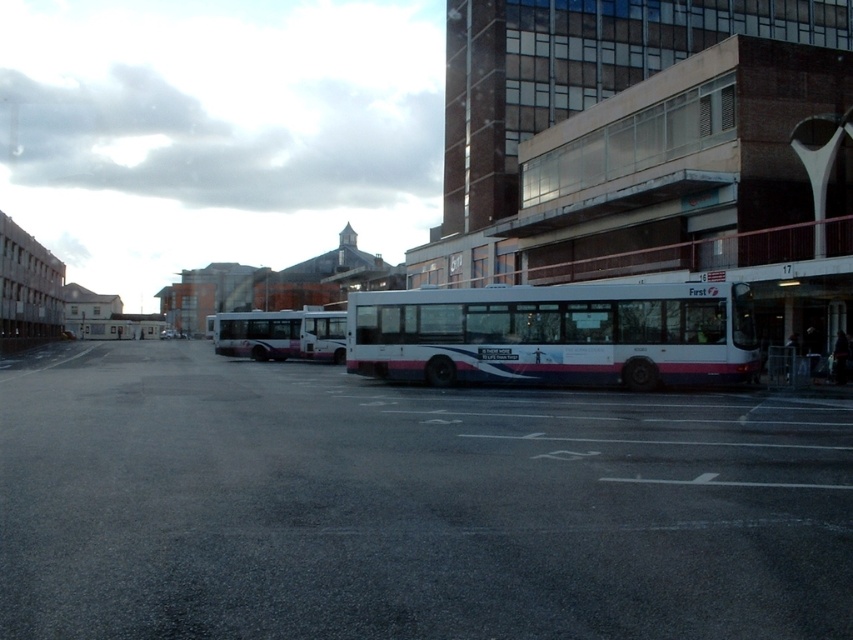
You are standing in the parking lot and want to reach a specific point marked at coordinates point (654, 563). If you can walk 3 meters per minute, how long will it take you to reach that point?

The distance of point (654, 563) from viewer is 6.22 meters. At a walking speed of 3 meters per minute, it would take approximately 2.07 minutes to reach the point.

You are a pedestrian standing at the edge of the parking lot and see both the white matte bus at center and the white glossy bus at center. Which bus appears lower in the image?

The white matte bus at center appears lower in the image because it is positioned below the white glossy bus at center.